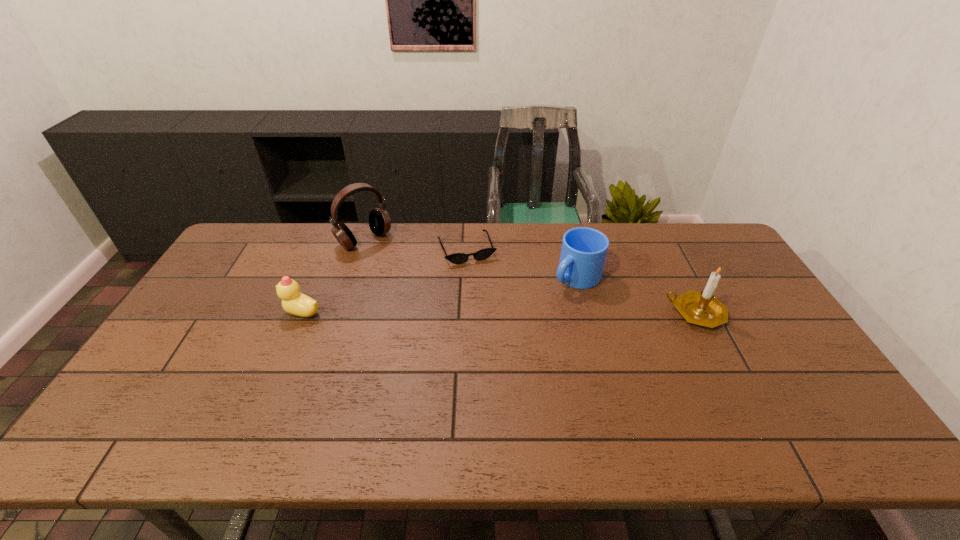
Where is `duckling`? duckling is located at coordinates (294, 302).

Locate an element on the screen. the rightmost object is located at coordinates (702, 308).

What are the coordinates of `candle holder` in the screenshot? It's located at (702, 308).

Where is `headset`? headset is located at coordinates (379, 220).

Where is `the second object from right to left`? the second object from right to left is located at coordinates (583, 254).

Identify the location of the third object from right to left. This screenshot has width=960, height=540. (457, 258).

At what (x,y) coordinates should I click in order to perform the action: click on sunglasses. Please return your answer as a coordinate pair (x, y). The image size is (960, 540). Looking at the image, I should click on (457, 258).

Identify the location of free space located on the front-facing side of the duckling. (213, 312).

Locate an element on the screen. This screenshot has height=540, width=960. free location located 0.170m on the front-facing side of the duckling is located at coordinates (224, 312).

The image size is (960, 540). Find the location of `free space located 0.190m on the front-facing side of the duckling`. free space located 0.190m on the front-facing side of the duckling is located at coordinates (217, 312).